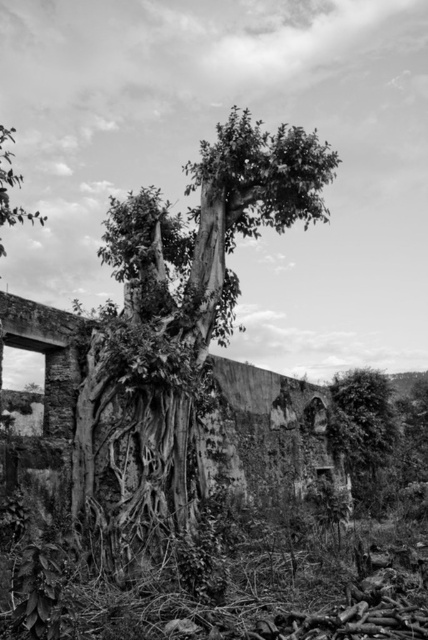
You are a nature photographer aiming to capture the interaction between the textured bark tree at center and the thick textured foliage at right. From your current position, which object would you need to adjust your camera angle upwards to photograph?

You would need to adjust your camera angle upwards to photograph the textured bark tree at center because it is located above the thick textured foliage at right.

Based on the scene described, which object is taller between the textured bark tree at center and the thick textured foliage at right?

The textured bark tree at center is much taller than the thick textured foliage at right.